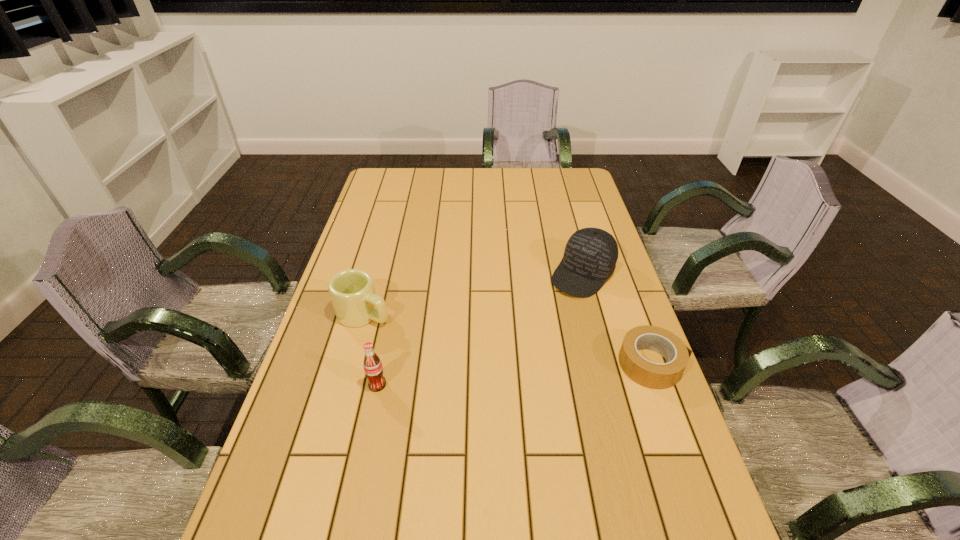
At what (x,y) coordinates should I click in order to perform the action: click on object that stands as the closest to the duct tape. Please return your answer as a coordinate pair (x, y). Looking at the image, I should click on (590, 257).

Find the location of a particular element. object that ranks as the closest to the soda is located at coordinates (352, 292).

Locate an element on the screen. free space that satisfies the following two spatial constraints: 1. on the front side of the second farthest object; 2. on the left side of the soda is located at coordinates (345, 384).